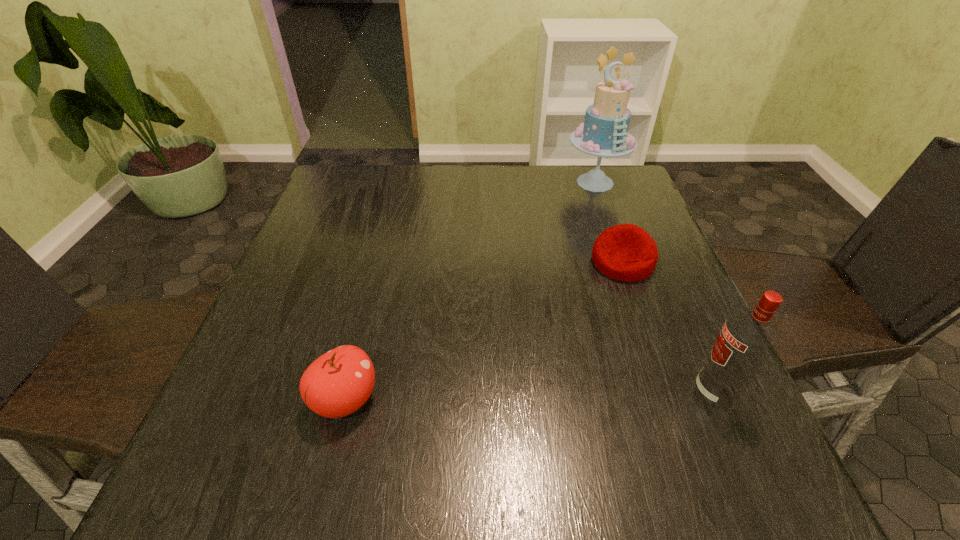
The image size is (960, 540). Find the location of `vacant region located 0.170m on the front label of the vodka`. vacant region located 0.170m on the front label of the vodka is located at coordinates (594, 393).

In order to click on free space located on the seat area of the third nearest object in this screenshot , I will do `click(601, 310)`.

At what (x,y) coordinates should I click in order to perform the action: click on free location located 0.320m on the seat area of the third nearest object. Please return your answer as a coordinate pair (x, y). Looking at the image, I should click on click(565, 393).

The image size is (960, 540). In order to click on vacant space situated on the seat area of the third nearest object in this screenshot , I will do `click(558, 411)`.

Where is `vacant space located with a ladder on the side of the farthest object`? vacant space located with a ladder on the side of the farthest object is located at coordinates (591, 222).

What are the coordinates of `vacant space located with a ladder on the side of the farthest object` in the screenshot? It's located at (587, 267).

The width and height of the screenshot is (960, 540). What are the coordinates of `blank area located with a ladder on the side of the farthest object` in the screenshot? It's located at (591, 219).

The height and width of the screenshot is (540, 960). Identify the location of object located at the far edge. (604, 133).

This screenshot has height=540, width=960. Identify the location of apple located at the near edge. (339, 382).

Locate an element on the screen. vodka at the near edge is located at coordinates (747, 339).